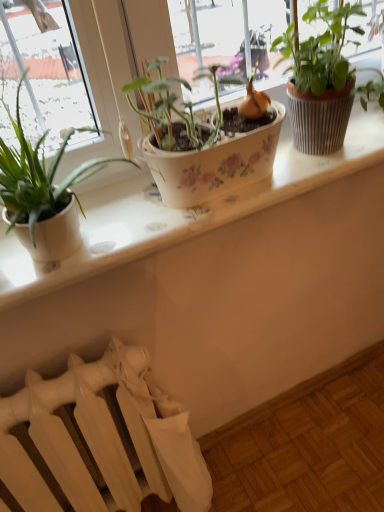
Question: Is matte white pot at left, which ranks as the 1th houseplant in left-to-right order, behind white matte radiator at lower left?

Choices:
 (A) no
 (B) yes

Answer: (A)

Question: Can you confirm if matte white pot at left, the 2th houseplant positioned from the right, is thinner than white matte radiator at lower left?

Choices:
 (A) yes
 (B) no

Answer: (B)

Question: Could you tell me if matte white pot at left, the 2th houseplant positioned from the right, is turned towards white matte radiator at lower left?

Choices:
 (A) no
 (B) yes

Answer: (A)

Question: Are matte white pot at left, the 2th houseplant positioned from the right, and white matte radiator at lower left making contact?

Choices:
 (A) yes
 (B) no

Answer: (B)

Question: Considering the relative sizes of matte white pot at left, the 2th houseplant positioned from the right, and white matte radiator at lower left in the image provided, is matte white pot at left, the 2th houseplant positioned from the right, smaller than white matte radiator at lower left?

Choices:
 (A) yes
 (B) no

Answer: (A)

Question: From the image's perspective, is matte white pot at left, the 2th houseplant positioned from the right, under white matte radiator at lower left?

Choices:
 (A) no
 (B) yes

Answer: (A)

Question: Could you tell me if white ceramic window sill at center is turned towards textured brown pot at upper right, the 1th houseplant viewed from the right?

Choices:
 (A) yes
 (B) no

Answer: (B)

Question: Is white ceramic window sill at center positioned behind textured brown pot at upper right, the 1th houseplant viewed from the right?

Choices:
 (A) no
 (B) yes

Answer: (B)

Question: Considering the relative sizes of white ceramic window sill at center and textured brown pot at upper right, acting as the 2th houseplant starting from the left, in the image provided, is white ceramic window sill at center taller than textured brown pot at upper right, acting as the 2th houseplant starting from the left,?

Choices:
 (A) no
 (B) yes

Answer: (A)

Question: From a real-world perspective, is white ceramic window sill at center located beneath textured brown pot at upper right, acting as the 2th houseplant starting from the left?

Choices:
 (A) no
 (B) yes

Answer: (B)

Question: Does white ceramic window sill at center come in front of textured brown pot at upper right, the 1th houseplant viewed from the right?

Choices:
 (A) no
 (B) yes

Answer: (A)

Question: Is the surface of white ceramic window sill at center in direct contact with textured brown pot at upper right, acting as the 2th houseplant starting from the left?

Choices:
 (A) yes
 (B) no

Answer: (B)

Question: From a real-world perspective, is textured brown pot at upper right, acting as the 2th houseplant starting from the left, below white ceramic window sill at center?

Choices:
 (A) no
 (B) yes

Answer: (A)